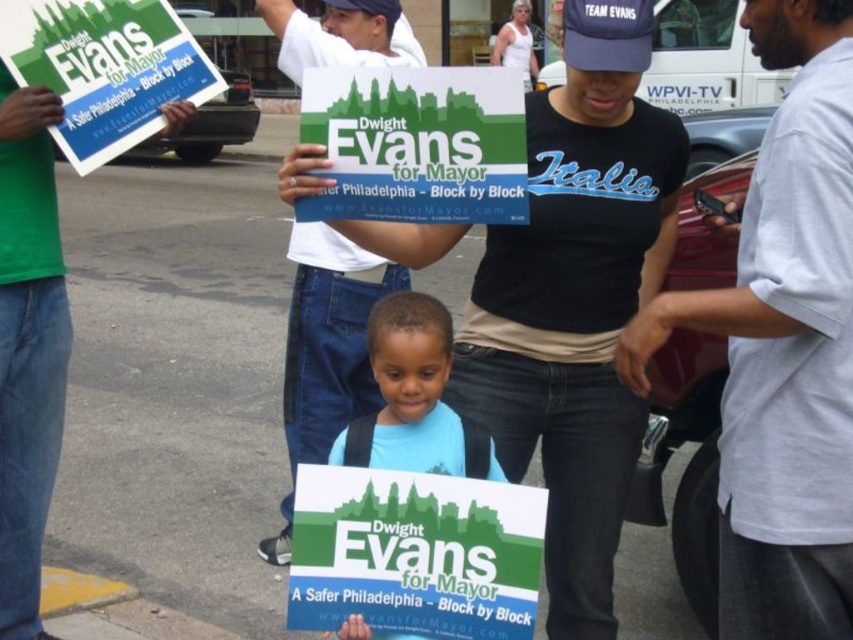
You are standing at the point labeled as point (10,408) and want to move towards the point labeled as point (473,80). Which direction should you move?

You should move towards the point (473,80) by moving in the direction closer to the viewer since it is closer than point (10,408).